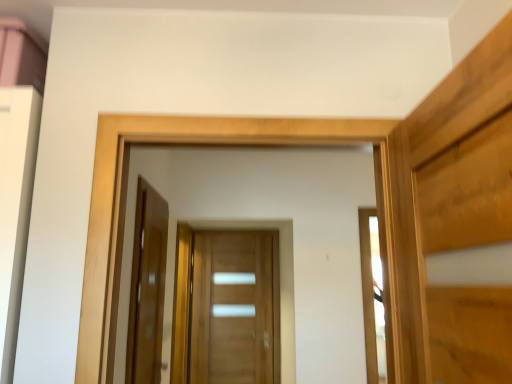
The width and height of the screenshot is (512, 384). What do you see at coordinates (232, 308) in the screenshot? I see `wooden door at center, the 2th door in the front-to-back sequence` at bounding box center [232, 308].

Measure the distance between wooden door at center, acting as the 1th door starting from the right, and camera.

A distance of 3.74 meters exists between wooden door at center, acting as the 1th door starting from the right, and camera.

Find the location of `wooden door at center, positioned as the second door in left-to-right order`. wooden door at center, positioned as the second door in left-to-right order is located at coordinates (232, 308).

Measure the distance between glossy wood door at center, placed as the 1th door when sorted from front to back, and camera.

A distance of 1.88 meters exists between glossy wood door at center, placed as the 1th door when sorted from front to back, and camera.

Describe the element at coordinates (147, 287) in the screenshot. This screenshot has width=512, height=384. I see `glossy wood door at center, the 2th door from the back` at that location.

Where is `glossy wood door at center, the 2th door from the back`? The width and height of the screenshot is (512, 384). glossy wood door at center, the 2th door from the back is located at coordinates click(x=147, y=287).

The width and height of the screenshot is (512, 384). What are the coordinates of `wooden door at center, positioned as the second door in left-to-right order` in the screenshot? It's located at (232, 308).

Does glossy wood door at center, the 2th door from the back, appear on the left side of wooden door at center, the first door from the back?

Yes, glossy wood door at center, the 2th door from the back, is to the left of wooden door at center, the first door from the back.

Between glossy wood door at center, placed as the 1th door when sorted from front to back, and wooden door at center, the 2th door in the front-to-back sequence, which one is positioned behind?

wooden door at center, the 2th door in the front-to-back sequence, is further away from the camera.

Considering the positions of points (155, 315) and (190, 378), is point (155, 315) farther from camera compared to point (190, 378)?

No, (155, 315) is in front of (190, 378).

From the image's perspective, is glossy wood door at center, placed as the 1th door when sorted from front to back, located above or below wooden door at center, positioned as the second door in left-to-right order?

Based on their image positions, glossy wood door at center, placed as the 1th door when sorted from front to back, is located above wooden door at center, positioned as the second door in left-to-right order.

From a real-world perspective, which object stands above the other?

glossy wood door at center, placed as the 1th door when sorted from front to back, from a real-world perspective.

Considering the sizes of objects glossy wood door at center, the 2th door from the back, and wooden door at center, the first door from the back, in the image provided, who is wider, glossy wood door at center, the 2th door from the back, or wooden door at center, the first door from the back,?

With larger width is wooden door at center, the first door from the back.

Is glossy wood door at center, placed as the 1th door when sorted from left to right, taller than wooden door at center, acting as the 1th door starting from the right?

Incorrect, the height of glossy wood door at center, placed as the 1th door when sorted from left to right, is not larger of that of wooden door at center, acting as the 1th door starting from the right.

Does glossy wood door at center, the 2th door from the back, have a larger size compared to wooden door at center, positioned as the second door in left-to-right order?

No.

Is glossy wood door at center, placed as the 1th door when sorted from front to back, surrounding wooden door at center, acting as the 1th door starting from the right?

No, wooden door at center, acting as the 1th door starting from the right, is not a part of glossy wood door at center, placed as the 1th door when sorted from front to back.

Are glossy wood door at center, placed as the 1th door when sorted from front to back, and wooden door at center, acting as the 1th door starting from the right, beside each other?

No, glossy wood door at center, placed as the 1th door when sorted from front to back, is not next to wooden door at center, acting as the 1th door starting from the right.

Is glossy wood door at center, placed as the 1th door when sorted from left to right, positioned with its back to wooden door at center, the 2th door in the front-to-back sequence?

That's not correct — glossy wood door at center, placed as the 1th door when sorted from left to right, is not looking away from wooden door at center, the 2th door in the front-to-back sequence.

Measure the distance from glossy wood door at center, the second door in the right-to-left sequence, to wooden door at center, acting as the 1th door starting from the right.

glossy wood door at center, the second door in the right-to-left sequence, is 4.91 feet away from wooden door at center, acting as the 1th door starting from the right.

You are a GUI agent. You are given a task and a screenshot of the screen. Output one action in this format:
    pyautogui.click(x=<x>, y=<y>)
    Task: Click on the door behind the glossy wood door at center, the 2th door from the back
    Image resolution: width=512 pixels, height=384 pixels.
    Given the screenshot: What is the action you would take?
    pyautogui.click(x=232, y=308)

Can you confirm if wooden door at center, the first door from the back, is positioned to the right of glossy wood door at center, placed as the 1th door when sorted from left to right?

Indeed, wooden door at center, the first door from the back, is positioned on the right side of glossy wood door at center, placed as the 1th door when sorted from left to right.

Which object is further away from the camera, wooden door at center, the 2th door in the front-to-back sequence, or glossy wood door at center, placed as the 1th door when sorted from left to right?

Positioned behind is wooden door at center, the 2th door in the front-to-back sequence.

Which is in front, point (242, 349) or point (146, 324)?

The point (146, 324) is in front.

From the image's perspective, who appears lower, wooden door at center, the 2th door in the front-to-back sequence, or glossy wood door at center, placed as the 1th door when sorted from left to right?

wooden door at center, the 2th door in the front-to-back sequence.

From a real-world perspective, does wooden door at center, the 2th door in the front-to-back sequence, sit lower than glossy wood door at center, placed as the 1th door when sorted from front to back?

Yes, from a real-world perspective, wooden door at center, the 2th door in the front-to-back sequence, is under glossy wood door at center, placed as the 1th door when sorted from front to back.

Does wooden door at center, acting as the 1th door starting from the right, have a lesser width compared to glossy wood door at center, the 2th door from the back?

No, wooden door at center, acting as the 1th door starting from the right, is not thinner than glossy wood door at center, the 2th door from the back.

Is wooden door at center, the 2th door in the front-to-back sequence, taller than glossy wood door at center, placed as the 1th door when sorted from front to back?

Indeed, wooden door at center, the 2th door in the front-to-back sequence, has a greater height compared to glossy wood door at center, placed as the 1th door when sorted from front to back.

Considering the sizes of objects wooden door at center, positioned as the second door in left-to-right order, and glossy wood door at center, the second door in the right-to-left sequence, in the image provided, who is smaller, wooden door at center, positioned as the second door in left-to-right order, or glossy wood door at center, the second door in the right-to-left sequence,?

glossy wood door at center, the second door in the right-to-left sequence.

Would you say wooden door at center, the 2th door in the front-to-back sequence, contains glossy wood door at center, placed as the 1th door when sorted from front to back?

No, glossy wood door at center, placed as the 1th door when sorted from front to back, is not surrounded by wooden door at center, the 2th door in the front-to-back sequence.

Are wooden door at center, acting as the 1th door starting from the right, and glossy wood door at center, the second door in the right-to-left sequence, far apart?

Yes, wooden door at center, acting as the 1th door starting from the right, is far from glossy wood door at center, the second door in the right-to-left sequence.

Is wooden door at center, the 2th door in the front-to-back sequence, turned away from glossy wood door at center, the second door in the right-to-left sequence?

No, wooden door at center, the 2th door in the front-to-back sequence,'s orientation is not away from glossy wood door at center, the second door in the right-to-left sequence.

Find the location of a particular element. door beneath the glossy wood door at center, the second door in the right-to-left sequence (from a real-world perspective) is located at coordinates (232, 308).

The image size is (512, 384). I want to click on door that appears behind the glossy wood door at center, the 2th door from the back, so click(x=232, y=308).

In order to click on door on the right of glossy wood door at center, the second door in the right-to-left sequence in this screenshot , I will do `click(232, 308)`.